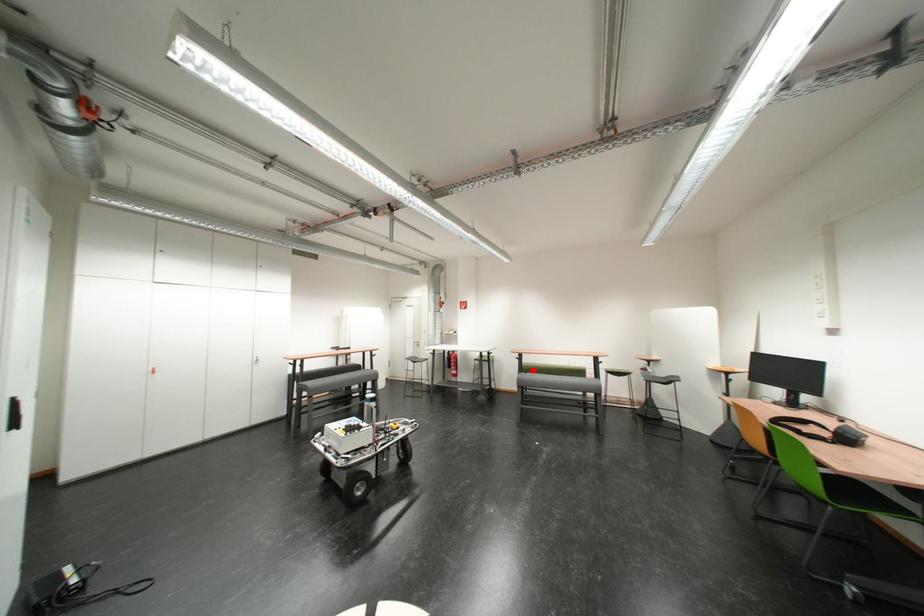
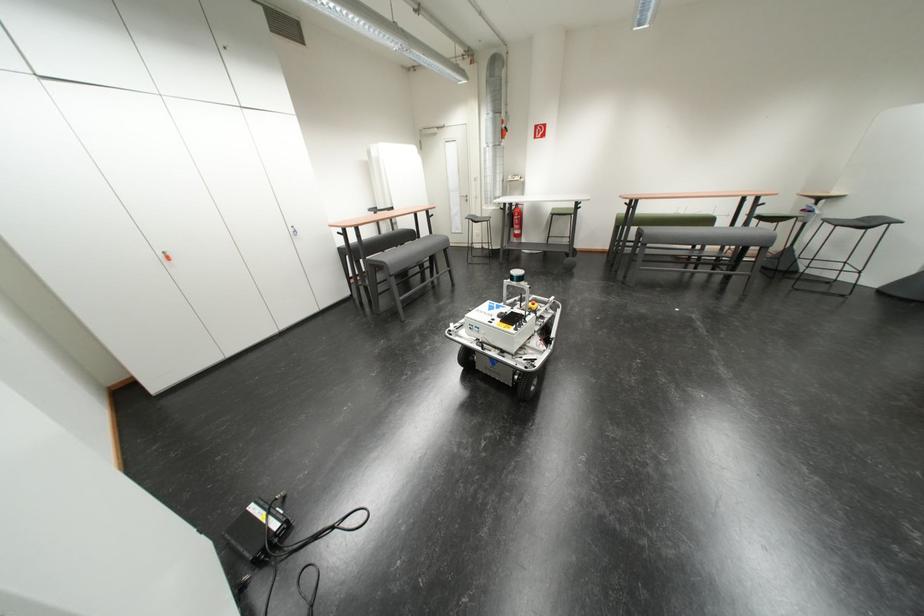
Question: A red point is marked in image1. In image2, is the corresponding 3D point closer to the camera or farther? Reply with the corresponding letter.

Choices:
 (A) The corresponding 3D point is closer.
 (B) The corresponding 3D point is farther.

Answer: (A)